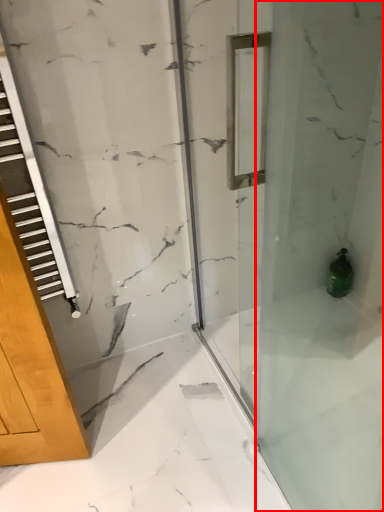
Question: From the image's perspective, where is shower door (annotated by the red box) located in relation to bottle in the image?

Choices:
 (A) above
 (B) below

Answer: (A)